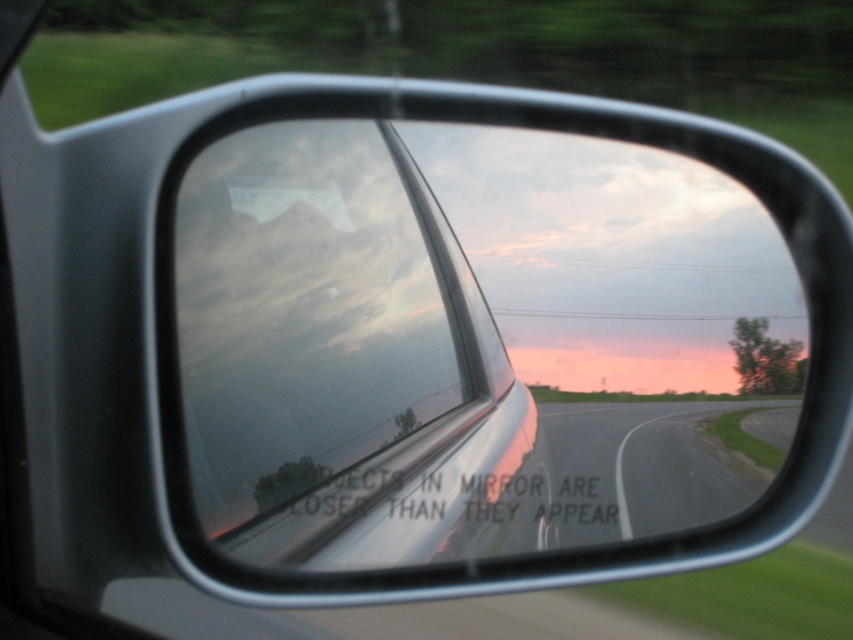
Question: Which point is farther to the camera?

Choices:
 (A) transparent glass car window at center
 (B) asphalt road at center

Answer: (B)

Question: Is transparent glass car window at center below asphalt road at center?

Choices:
 (A) no
 (B) yes

Answer: (A)

Question: Which point appears farthest from the camera in this image?

Choices:
 (A) (527, 481)
 (B) (695, 474)

Answer: (B)

Question: Observing the image, what is the correct spatial positioning of transparent glass car window at center in reference to asphalt road at center?

Choices:
 (A) above
 (B) below

Answer: (A)

Question: Which object is farther from the camera taking this photo?

Choices:
 (A) transparent glass car window at center
 (B) asphalt road at center

Answer: (B)

Question: Can you confirm if transparent glass car window at center is thinner than asphalt road at center?

Choices:
 (A) yes
 (B) no

Answer: (A)